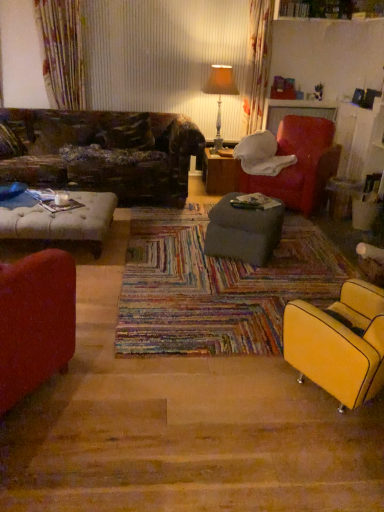
The image size is (384, 512). What do you see at coordinates (339, 343) in the screenshot? I see `matte yellow armchair at lower right, which appears as the second chair when viewed from the top` at bounding box center [339, 343].

At what (x,y) coordinates should I click in order to perform the action: click on matte red armchair at upper right, which is the 2th chair in bottom-to-top order. Please return your answer as a coordinate pair (x, y). The image size is (384, 512). Looking at the image, I should click on (300, 164).

Where is `gray fabric ottoman at center, which is counted as the first table, starting from the bottom`? gray fabric ottoman at center, which is counted as the first table, starting from the bottom is located at coordinates (243, 232).

Where is `wooden table at center, the 2th table from the bottom`? The image size is (384, 512). wooden table at center, the 2th table from the bottom is located at coordinates (220, 173).

Locate an element on the screen. Image resolution: width=384 pixels, height=512 pixels. matte yellow armchair at lower right, which appears as the second chair when viewed from the top is located at coordinates (339, 343).

Find the location of `chair in front of the gray fabric ottoman at center, which is counted as the first table, starting from the bottom`. chair in front of the gray fabric ottoman at center, which is counted as the first table, starting from the bottom is located at coordinates (339, 343).

Which of these two, gray fabric ottoman at center, arranged as the 2th table when viewed from the back, or matte yellow armchair at lower right, which is the second chair from back to front, is bigger?

Bigger between the two is matte yellow armchair at lower right, which is the second chair from back to front.

Would you say gray fabric ottoman at center, placed as the 2th table when sorted from top to bottom, is inside or outside matte yellow armchair at lower right, the 1th chair positioned from the bottom?

gray fabric ottoman at center, placed as the 2th table when sorted from top to bottom, cannot be found inside matte yellow armchair at lower right, the 1th chair positioned from the bottom.

Can you tell me how much gray fabric ottoman at center, arranged as the 2th table when viewed from the back, and matte yellow armchair at lower right, which is the second chair from back to front, differ in facing direction?

The facing directions of gray fabric ottoman at center, arranged as the 2th table when viewed from the back, and matte yellow armchair at lower right, which is the second chair from back to front, are 28.6 degrees apart.

Does leather-like brown pillow at upper left contain matte red armchair at upper right, the 1th chair from the top?

Definitely not — matte red armchair at upper right, the 1th chair from the top, is not inside leather-like brown pillow at upper left.

From a real-world perspective, starting from the leather-like brown pillow at upper left, which chair is the 1st one below it? Please provide its 2D coordinates.

[(300, 164)]

Based on the photo, between leather-like brown pillow at upper left and matte red armchair at upper right, the 2th chair from the front, which one appears on the left side from the viewer's perspective?

leather-like brown pillow at upper left.

Considering the sizes of objects matte red armchair at upper right, the 2th chair from the front, and wooden table at center, the 2th table from the bottom, in the image provided, who is shorter, matte red armchair at upper right, the 2th chair from the front, or wooden table at center, the 2th table from the bottom,?

With less height is wooden table at center, the 2th table from the bottom.

Considering the relative positions of matte red armchair at upper right, the 1th chair from the top, and wooden table at center, the 2th table from the bottom, in the image provided, is matte red armchair at upper right, the 1th chair from the top, to the right of wooden table at center, the 2th table from the bottom, from the viewer's perspective?

Indeed, matte red armchair at upper right, the 1th chair from the top, is positioned on the right side of wooden table at center, the 2th table from the bottom.

From the image's perspective, which object appears higher, matte red armchair at upper right, the 2th chair from the front, or wooden table at center, the 1th table from the top?

From the image's view, wooden table at center, the 1th table from the top, is above.

Is wooden table at center, the first table viewed from the back, at the back of matte red armchair at upper right, which is the 2th chair in bottom-to-top order?

matte red armchair at upper right, which is the 2th chair in bottom-to-top order, does not have its back to wooden table at center, the first table viewed from the back.

You are a GUI agent. You are given a task and a screenshot of the screen. Output one action in this format:
    pyautogui.click(x=<x>, y=<y>)
    Task: Click on the lamp on the left of matte red armchair at upper right, the 1th chair from the top
    This screenshot has height=512, width=384.
    Given the screenshot: What is the action you would take?
    pyautogui.click(x=220, y=93)

Is matte red armchair at upper right, the 1th chair from the top, touching orange fabric lampshade at upper center?

No, matte red armchair at upper right, the 1th chair from the top, is not with orange fabric lampshade at upper center.

Is matte red armchair at upper right, the 2th chair from the front, positioned before orange fabric lampshade at upper center?

Yes.

Can you confirm if matte red armchair at upper right, which is the 2th chair in bottom-to-top order, is smaller than matte yellow armchair at lower right, which ranks as the first chair in front-to-back order?

Incorrect, matte red armchair at upper right, which is the 2th chair in bottom-to-top order, is not smaller in size than matte yellow armchair at lower right, which ranks as the first chair in front-to-back order.

Is matte red armchair at upper right, which is the 2th chair in bottom-to-top order, aimed at matte yellow armchair at lower right, which appears as the second chair when viewed from the top?

No, matte red armchair at upper right, which is the 2th chair in bottom-to-top order, is not facing towards matte yellow armchair at lower right, which appears as the second chair when viewed from the top.

Is point (336, 170) closer to viewer compared to point (365, 334)?

No.

This screenshot has height=512, width=384. In order to click on chair lying behind the matte yellow armchair at lower right, which appears as the second chair when viewed from the top in this screenshot , I will do `click(300, 164)`.

Where is `pillow that is above the gray fabric ottoman at center, placed as the 2th table when sorted from top to bottom (from the image's perspective)`? The width and height of the screenshot is (384, 512). pillow that is above the gray fabric ottoman at center, placed as the 2th table when sorted from top to bottom (from the image's perspective) is located at coordinates point(125,131).

Is gray fabric ottoman at center, the 1th table viewed from the front, shorter than leather-like brown pillow at upper left?

Correct, gray fabric ottoman at center, the 1th table viewed from the front, is not as tall as leather-like brown pillow at upper left.

Visually, is gray fabric ottoman at center, placed as the 2th table when sorted from top to bottom, positioned to the left or to the right of leather-like brown pillow at upper left?

Clearly, gray fabric ottoman at center, placed as the 2th table when sorted from top to bottom, is on the right of leather-like brown pillow at upper left in the image.

Which point is more distant from viewer, (248, 234) or (110, 116)?

The point (110, 116) is more distant.

Looking at this image, which of these two, matte yellow armchair at lower right, which is the second chair from back to front, or matte red armchair at upper right, the 1th chair from the top, stands taller?

matte red armchair at upper right, the 1th chair from the top, is taller.

Is matte yellow armchair at lower right, which appears as the second chair when viewed from the top, with matte red armchair at upper right, the 2th chair from the front?

There is a gap between matte yellow armchair at lower right, which appears as the second chair when viewed from the top, and matte red armchair at upper right, the 2th chair from the front.

Which object is further away from the camera, matte yellow armchair at lower right, which is the second chair from back to front, or matte red armchair at upper right, the 1th chair from the top?

matte red armchair at upper right, the 1th chair from the top, is behind.

Is point (348, 298) closer or farther from the camera than point (251, 177)?

Point (348, 298) is positioned closer to the camera compared to point (251, 177).

This screenshot has width=384, height=512. What are the coordinates of `table that is the 1st one when counting upward from the matte yellow armchair at lower right, which appears as the second chair when viewed from the top (from the image's perspective)` in the screenshot? It's located at (243, 232).

Locate an element on the screen. This screenshot has height=512, width=384. pillow that is above the matte red armchair at upper right, which appears as the 1th chair when viewed from the back (from a real-world perspective) is located at coordinates (125, 131).

When comparing their distances from matte yellow armchair at lower right, the 1th chair positioned from the bottom, does matte red armchair at upper right, the 1th chair from the top, or gray fabric ottoman at center, which is counted as the first table, starting from the bottom, seem closer?

gray fabric ottoman at center, which is counted as the first table, starting from the bottom, lies closer to matte yellow armchair at lower right, the 1th chair positioned from the bottom, than the other object.

Considering their positions, is gray fabric ottoman at center, placed as the 2th table when sorted from top to bottom, positioned closer to wooden table at center, which is counted as the second table, starting from the front, than orange fabric lampshade at upper center?

orange fabric lampshade at upper center.

Based on their spatial positions, is orange fabric lampshade at upper center or wooden table at center, the first table viewed from the back, closer to leather-like brown pillow at upper left?

wooden table at center, the first table viewed from the back, lies closer to leather-like brown pillow at upper left than the other object.

Estimate the real-world distances between objects in this image. Which object is closer to wooden table at center, the first table viewed from the back, matte red armchair at upper right, which is the 2th chair in bottom-to-top order, or matte yellow armchair at lower right, which is the second chair from back to front?

The object closer to wooden table at center, the first table viewed from the back, is matte red armchair at upper right, which is the 2th chair in bottom-to-top order.

From the image, which object appears to be nearer to leather-like brown pillow at upper left, matte yellow armchair at lower right, the 1th chair positioned from the bottom, or matte red armchair at upper right, which appears as the 1th chair when viewed from the back?

Among the two, matte red armchair at upper right, which appears as the 1th chair when viewed from the back, is located nearer to leather-like brown pillow at upper left.

Looking at the image, which one is located further to wooden table at center, the 1th table from the top, orange fabric lampshade at upper center or matte yellow armchair at lower right, which appears as the second chair when viewed from the top?

matte yellow armchair at lower right, which appears as the second chair when viewed from the top, lies further to wooden table at center, the 1th table from the top, than the other object.

Looking at the image, which one is located further to matte red armchair at upper right, the 1th chair from the top, orange fabric lampshade at upper center or leather-like brown pillow at upper left?

leather-like brown pillow at upper left.

When comparing their distances from matte red armchair at upper right, the 2th chair from the front, does leather-like brown pillow at upper left or orange fabric lampshade at upper center seem closer?

orange fabric lampshade at upper center is closer to matte red armchair at upper right, the 2th chair from the front.

Where is `pillow positioned between gray fabric ottoman at center, which is counted as the first table, starting from the bottom, and wooden table at center, the 1th table from the top, from near to far`? The image size is (384, 512). pillow positioned between gray fabric ottoman at center, which is counted as the first table, starting from the bottom, and wooden table at center, the 1th table from the top, from near to far is located at coordinates 125,131.

Where is `chair positioned between matte yellow armchair at lower right, the 1th chair positioned from the bottom, and wooden table at center, the first table viewed from the back, from near to far`? Image resolution: width=384 pixels, height=512 pixels. chair positioned between matte yellow armchair at lower right, the 1th chair positioned from the bottom, and wooden table at center, the first table viewed from the back, from near to far is located at coordinates (300, 164).

Locate an element on the screen. The height and width of the screenshot is (512, 384). lamp located between matte red armchair at upper right, which appears as the 1th chair when viewed from the back, and wooden table at center, which is counted as the second table, starting from the front, in the depth direction is located at coordinates (220, 93).

You are a GUI agent. You are given a task and a screenshot of the screen. Output one action in this format:
    pyautogui.click(x=<x>, y=<y>)
    Task: Click on the table located between matte yellow armchair at lower right, the 1th chair positioned from the bottom, and leather-like brown pillow at upper left in the depth direction
    The height and width of the screenshot is (512, 384).
    Given the screenshot: What is the action you would take?
    pyautogui.click(x=243, y=232)